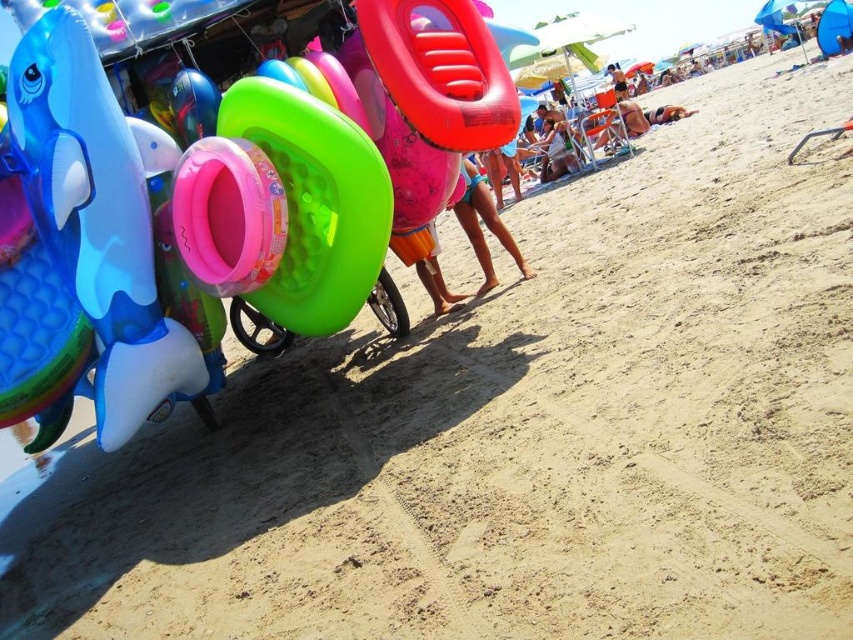
You are a photographer trying to capture a photo of the tan skin person at lower right and the pink matte swimsuit at center. Based on their positions, which object should you focus on first to ensure both are in the frame?

The pink matte swimsuit at center is below the tan skin person at lower right, so you should focus on the tan skin person at lower right first to ensure both are in the frame.

You are a customer at the beach toy store and want to know if the rubber inflatable ring at left and the blue rubber dolphin at left are close enough to be placed together on a small shelf. Can you determine if they can fit together on the shelf if the shelf is 20 centimeters wide?

The rubber inflatable ring at left is 15.29 centimeters away from the blue rubber dolphin at left. Since the distance between them is less than the shelf width of 20 centimeters, they can fit together on the shelf.

You are a beachgoer looking for a swimsuit. You see a pink matte swimsuit at center and a tan skin person at lower right. Which object is positioned to the left?

The pink matte swimsuit at center is to the left of the tan skin person at lower right.